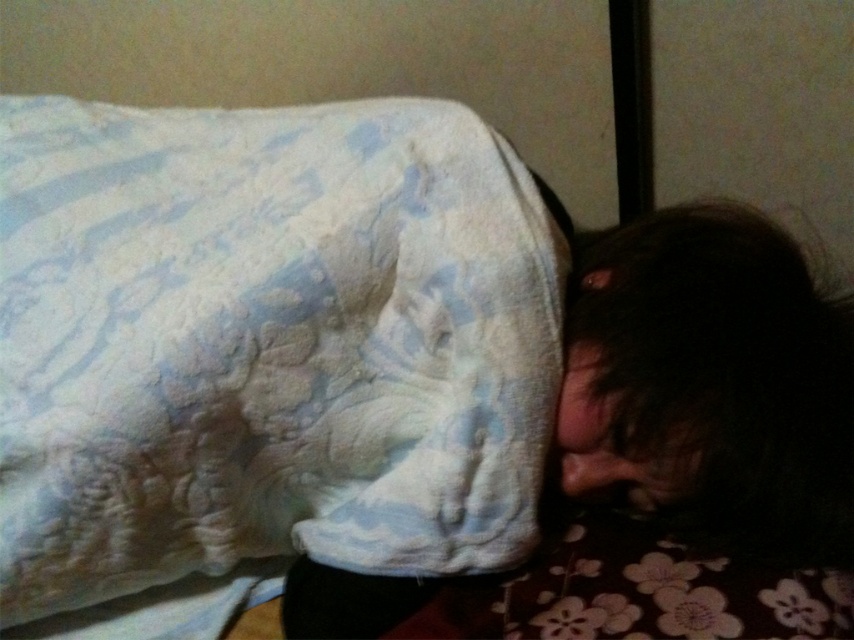
You are standing at the point closest to the bed. Which of the two points, point (208, 288) or point (759, 534), is closer to you?

Point (208, 288) is closer to you because it is in front of point (759, 534).

You are a photographer taking a portrait of the person in the bed. The camera is positioned at a certain distance. If the dark hair at lower right is in focus, will the camera also capture the pillow with a floral pattern in shades of pink and white in focus?

The dark hair at lower right and camera are 24.81 inches apart from each other. Since the pillow with a floral pattern in shades of pink and white is closer to the camera than the dark hair, it will also be in focus.